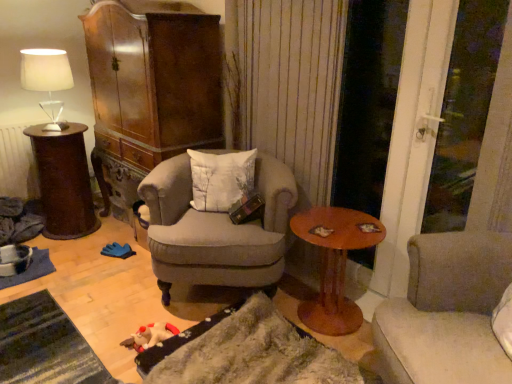
Image resolution: width=512 pixels, height=384 pixels. Describe the element at coordinates (334, 264) in the screenshot. I see `wooden round table at center, acting as the 2th table starting from the back` at that location.

In order to click on transparent glass screen door at right in this screenshot , I will do `click(367, 102)`.

This screenshot has width=512, height=384. What are the coordinates of `white textured pillow at center` in the screenshot? It's located at (220, 178).

What is the approximate width of white fabric lampshade at upper left?

12.93 inches.

This screenshot has width=512, height=384. What are the coordinates of `wooden round table at center, acting as the 1th table starting from the right` in the screenshot? It's located at tap(334, 264).

Is beige fabric studio couch at right positioned with its back to white fabric lampshade at upper left?

No.

In terms of height, does beige fabric studio couch at right look taller or shorter compared to white fabric lampshade at upper left?

In the image, beige fabric studio couch at right appears to be taller than white fabric lampshade at upper left.

Which object is positioned more to the left, beige fabric studio couch at right or white fabric lampshade at upper left?

Positioned to the left is white fabric lampshade at upper left.

Is beige fabric studio couch at right next to white fabric lampshade at upper left?

No, beige fabric studio couch at right is not touching white fabric lampshade at upper left.

Consider the image. Is transparent glass screen door at right looking in the opposite direction of dark brown wooden side table at left, positioned as the 1th table in back-to-front order?

Result: transparent glass screen door at right does not have its back to dark brown wooden side table at left, positioned as the 1th table in back-to-front order.

Considering the relative positions of transparent glass screen door at right and dark brown wooden side table at left, arranged as the second table when viewed from the front, in the image provided, is transparent glass screen door at right to the left or to the right of dark brown wooden side table at left, arranged as the second table when viewed from the front,?

From the image, it's evident that transparent glass screen door at right is to the right of dark brown wooden side table at left, arranged as the second table when viewed from the front.

Would you say wooden round table at center, positioned as the first table in front-to-back order, is to the left or to the right of light gray fabric armchair at center in the picture?

wooden round table at center, positioned as the first table in front-to-back order, is to the right of light gray fabric armchair at center.

Would you say wooden round table at center, acting as the 2th table starting from the back, is inside or outside light gray fabric armchair at center?

wooden round table at center, acting as the 2th table starting from the back, is not inside light gray fabric armchair at center, it's outside.

From a real-world perspective, is wooden round table at center, which ranks as the second table in left-to-right order, on light gray fabric armchair at center?

Actually, wooden round table at center, which ranks as the second table in left-to-right order, is physically below light gray fabric armchair at center in the real world.

Between white fabric lampshade at upper left and beige fabric studio couch at right, which one has smaller size?

white fabric lampshade at upper left is smaller.

From the image's perspective, would you say white fabric lampshade at upper left is positioned over beige fabric studio couch at right?

Yes.

Which object is positioned more to the left, white fabric lampshade at upper left or beige fabric studio couch at right?

white fabric lampshade at upper left.

Image resolution: width=512 pixels, height=384 pixels. Identify the location of screen door that is behind the fuzzy fabric blanket at lower center. click(367, 102).

In the scene shown: From a real-world perspective, is fuzzy fabric blanket at lower center positioned under transparent glass screen door at right based on gravity?

Yes, from a real-world perspective, fuzzy fabric blanket at lower center is under transparent glass screen door at right.

Consider the image. Is fuzzy fabric blanket at lower center with transparent glass screen door at right?

fuzzy fabric blanket at lower center and transparent glass screen door at right are not in contact.

In the scene shown: How different are the orientations of fuzzy fabric blanket at lower center and transparent glass screen door at right in degrees?

fuzzy fabric blanket at lower center and transparent glass screen door at right are facing 1.84 degrees away from each other.

Between light gray fabric armchair at center and transparent glass screen door at right, which one has larger width?

light gray fabric armchair at center is wider.

In the image, is light gray fabric armchair at center on the left side or the right side of transparent glass screen door at right?

In the image, light gray fabric armchair at center appears on the left side of transparent glass screen door at right.

From the image's perspective, is light gray fabric armchair at center positioned above or below transparent glass screen door at right?

light gray fabric armchair at center is situated lower than transparent glass screen door at right in the image.

Are light gray fabric armchair at center and transparent glass screen door at right far apart?

light gray fabric armchair at center is actually quite close to transparent glass screen door at right.

Considering the relative positions of transparent glass screen door at right and white textured pillow at center in the image provided, is transparent glass screen door at right to the right of white textured pillow at center from the viewer's perspective?

Indeed, transparent glass screen door at right is positioned on the right side of white textured pillow at center.

Which of these two, transparent glass screen door at right or white textured pillow at center, is thinner?

transparent glass screen door at right is thinner.

Would you say transparent glass screen door at right is inside or outside white textured pillow at center?

transparent glass screen door at right is located beyond the bounds of white textured pillow at center.

Where is `pillow that is below the transparent glass screen door at right (from the image's perspective)`? The image size is (512, 384). pillow that is below the transparent glass screen door at right (from the image's perspective) is located at coordinates (220, 178).

At what (x,y) coordinates should I click in order to perform the action: click on studio couch below the white fabric lampshade at upper left (from a real-world perspective). Please return your answer as a coordinate pair (x, y). Looking at the image, I should click on (447, 312).

I want to click on screen door located above the dark brown wooden side table at left, arranged as the second table when viewed from the front (from a real-world perspective), so click(x=367, y=102).

From the image, which object appears to be farther from white textured pillow at center, dark brown wooden side table at left, positioned as the 1th table in back-to-front order, or transparent glass screen door at right?

dark brown wooden side table at left, positioned as the 1th table in back-to-front order, is positioned further to the anchor white textured pillow at center.

From the image, which object appears to be nearer to transparent glass screen door at right, white fabric lampshade at upper left or dark brown wooden side table at left, positioned as the 1th table in back-to-front order?

Based on the image, white fabric lampshade at upper left appears to be nearer to transparent glass screen door at right.

Which object lies further to the anchor point dark brown wooden side table at left, which is counted as the second table, starting from the right, light gray fabric armchair at center or white textured pillow at center?

light gray fabric armchair at center.

When comparing their distances from dark brown wooden side table at left, arranged as the second table when viewed from the front, does light gray fabric armchair at center or wooden round table at center, acting as the 1th table starting from the right, seem further?

wooden round table at center, acting as the 1th table starting from the right, is further to dark brown wooden side table at left, arranged as the second table when viewed from the front.

Based on their spatial positions, is dark brown wooden side table at left, arranged as the second table when viewed from the front, or light gray fabric armchair at center further from wooden round table at center, positioned as the first table in front-to-back order?

dark brown wooden side table at left, arranged as the second table when viewed from the front, lies further to wooden round table at center, positioned as the first table in front-to-back order, than the other object.

Based on their spatial positions, is transparent glass screen door at right or fuzzy fabric blanket at lower center further from dark brown wooden side table at left, which is counted as the second table, starting from the right?

Based on the image, transparent glass screen door at right appears to be further to dark brown wooden side table at left, which is counted as the second table, starting from the right.

Consider the image. Looking at the image, which one is located further to transparent glass screen door at right, white fabric lampshade at upper left or light gray fabric armchair at center?

white fabric lampshade at upper left is further to transparent glass screen door at right.

Considering their positions, is white fabric lampshade at upper left positioned closer to fuzzy fabric blanket at lower center than white textured pillow at center?

white textured pillow at center is closer to fuzzy fabric blanket at lower center.

The width and height of the screenshot is (512, 384). Find the location of `table lamp between dark brown wooden side table at left, positioned as the 1th table in back-to-front order, and wooden round table at center, acting as the 2th table starting from the back, from left to right`. table lamp between dark brown wooden side table at left, positioned as the 1th table in back-to-front order, and wooden round table at center, acting as the 2th table starting from the back, from left to right is located at coordinates (47, 80).

The width and height of the screenshot is (512, 384). What are the coordinates of `pillow between fuzzy fabric blanket at lower center and dark brown wooden side table at left, acting as the 1th table starting from the left, along the z-axis` in the screenshot? It's located at (220, 178).

Locate an element on the screen. This screenshot has width=512, height=384. chair between dark brown wooden side table at left, which is counted as the second table, starting from the right, and beige fabric studio couch at right is located at coordinates (216, 230).

What are the coordinates of `table lamp between dark brown wooden side table at left, acting as the 1th table starting from the left, and transparent glass screen door at right from left to right` in the screenshot? It's located at (47, 80).